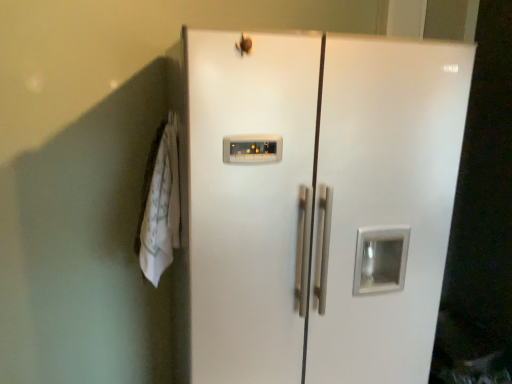
The height and width of the screenshot is (384, 512). Describe the element at coordinates (161, 208) in the screenshot. I see `white fabric towel at left` at that location.

Where is `white fabric towel at left`? The width and height of the screenshot is (512, 384). white fabric towel at left is located at coordinates (161, 208).

The height and width of the screenshot is (384, 512). What are the coordinates of `white glossy refrigerator at center` in the screenshot? It's located at (323, 204).

Image resolution: width=512 pixels, height=384 pixels. Describe the element at coordinates (323, 204) in the screenshot. I see `white glossy refrigerator at center` at that location.

This screenshot has height=384, width=512. I want to click on white fabric towel at left, so click(x=161, y=208).

Considering the relative positions of white fabric towel at left and white glossy refrigerator at center in the image provided, is white fabric towel at left to the right of white glossy refrigerator at center from the viewer's perspective?

Incorrect, white fabric towel at left is not on the right side of white glossy refrigerator at center.

Which object is further away from the camera taking this photo, white fabric towel at left or white glossy refrigerator at center?

white fabric towel at left.

Is point (158, 278) closer or farther from the camera than point (440, 266)?

Clearly, point (158, 278) is more distant from the camera than point (440, 266).

From the image's perspective, is white fabric towel at left below white glossy refrigerator at center?

No, from the image's perspective, white fabric towel at left is not below white glossy refrigerator at center.

From a real-world perspective, is white fabric towel at left physically located above or below white glossy refrigerator at center?

From a real-world perspective, white fabric towel at left is physically above white glossy refrigerator at center.

Between white fabric towel at left and white glossy refrigerator at center, which one has larger width?

With larger width is white glossy refrigerator at center.

Which of these two, white fabric towel at left or white glossy refrigerator at center, stands taller?

Standing taller between the two is white glossy refrigerator at center.

Which of these two, white fabric towel at left or white glossy refrigerator at center, is smaller?

white fabric towel at left is smaller.

Is white fabric towel at left located outside white glossy refrigerator at center?

white fabric towel at left is positioned outside white glossy refrigerator at center.

Are white fabric towel at left and white glossy refrigerator at center making contact?

white fabric towel at left is not next to white glossy refrigerator at center, and they're not touching.

Could you tell me if white fabric towel at left is turned towards white glossy refrigerator at center?

No, white fabric towel at left is not turned towards white glossy refrigerator at center.

In order to click on refrigerator below the white fabric towel at left (from a real-world perspective) in this screenshot , I will do `click(323, 204)`.

Does white glossy refrigerator at center appear on the right side of white fabric towel at left?

Correct, you'll find white glossy refrigerator at center to the right of white fabric towel at left.

Is white glossy refrigerator at center further to camera compared to white fabric towel at left?

No, white glossy refrigerator at center is in front of white fabric towel at left.

Considering the points (391, 204) and (174, 192), which point is behind, point (391, 204) or point (174, 192)?

Point (174, 192)

From the image's perspective, is white glossy refrigerator at center located above or below white fabric towel at left?

white glossy refrigerator at center is below white fabric towel at left.

From a real-world perspective, is white glossy refrigerator at center above or below white fabric towel at left?

white glossy refrigerator at center is below white fabric towel at left.

Which of these two, white glossy refrigerator at center or white fabric towel at left, is thinner?

white fabric towel at left.

Consider the image. Which of these two, white glossy refrigerator at center or white fabric towel at left, stands taller?

With more height is white glossy refrigerator at center.

Considering the sizes of objects white glossy refrigerator at center and white fabric towel at left in the image provided, who is smaller, white glossy refrigerator at center or white fabric towel at left?

With smaller size is white fabric towel at left.

Is white glossy refrigerator at center surrounding white fabric towel at left?

No.

From the picture: Are white glossy refrigerator at center and white fabric towel at left making contact?

No, white glossy refrigerator at center is not touching white fabric towel at left.

Is white fabric towel at left at the back of white glossy refrigerator at center?

That's not correct — white glossy refrigerator at center is not looking away from white fabric towel at left.

How many degrees apart are the facing directions of white glossy refrigerator at center and white fabric towel at left?

The facing directions of white glossy refrigerator at center and white fabric towel at left are 90 degrees apart.

Image resolution: width=512 pixels, height=384 pixels. I want to click on refrigerator located below the white fabric towel at left (from the image's perspective), so click(323, 204).

Where is `refrigerator below the white fabric towel at left (from the image's perspective)`? This screenshot has height=384, width=512. refrigerator below the white fabric towel at left (from the image's perspective) is located at coordinates (323, 204).

Locate an element on the screen. The height and width of the screenshot is (384, 512). refrigerator that appears in front of the white fabric towel at left is located at coordinates (323, 204).